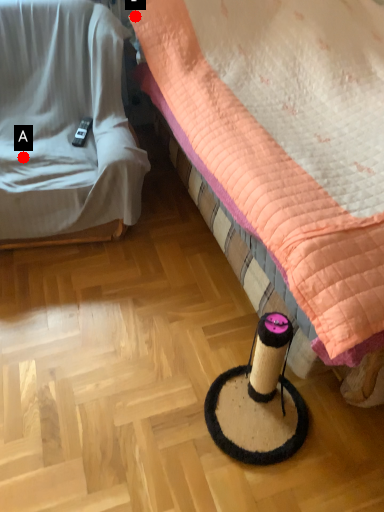
Question: Two points are circled on the image, labeled by A and B beside each circle. Which point is closer to the camera?

Choices:
 (A) A is closer
 (B) B is closer

Answer: (A)